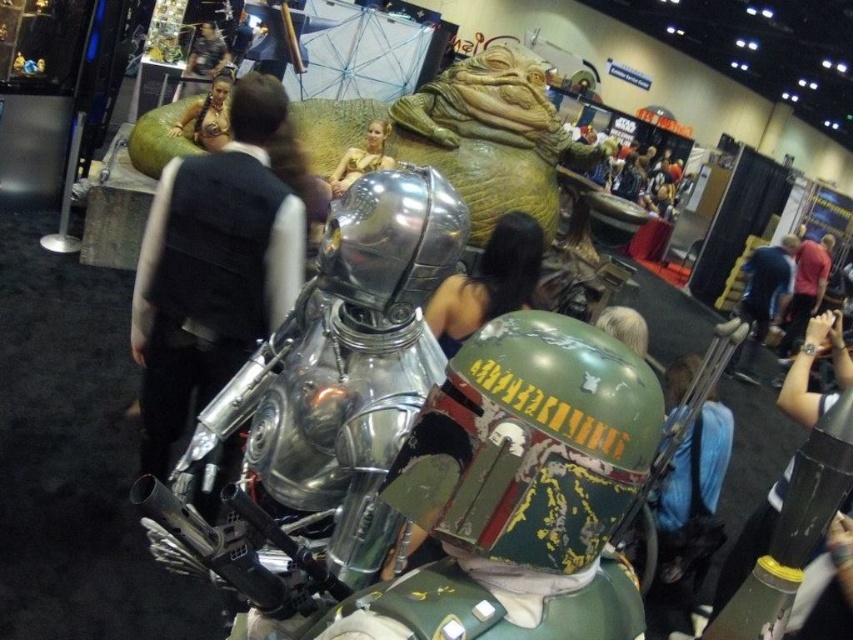
Question: Which point is farther from the camera taking this photo?

Choices:
 (A) (730, 588)
 (B) (140, 467)

Answer: (B)

Question: Can you confirm if blue fabric shirt at right is bigger than metallic gold bikini at upper center?

Choices:
 (A) yes
 (B) no

Answer: (A)

Question: Does metallic gold bikini at upper center appear over smooth beige sand at center?

Choices:
 (A) no
 (B) yes

Answer: (B)

Question: Does black fabric vest at center appear under blue fabric shirt at right?

Choices:
 (A) yes
 (B) no

Answer: (A)

Question: Which point is farther from the camera taking this photo?

Choices:
 (A) (769, 259)
 (B) (817, 298)

Answer: (B)

Question: Estimate the real-world distances between objects in this image. Which object is farther from the metallic gold bikini at upper center?

Choices:
 (A) blue fabric bag at lower right
 (B) smooth beige sand at center
 (C) shiny silver helmet at center

Answer: (A)